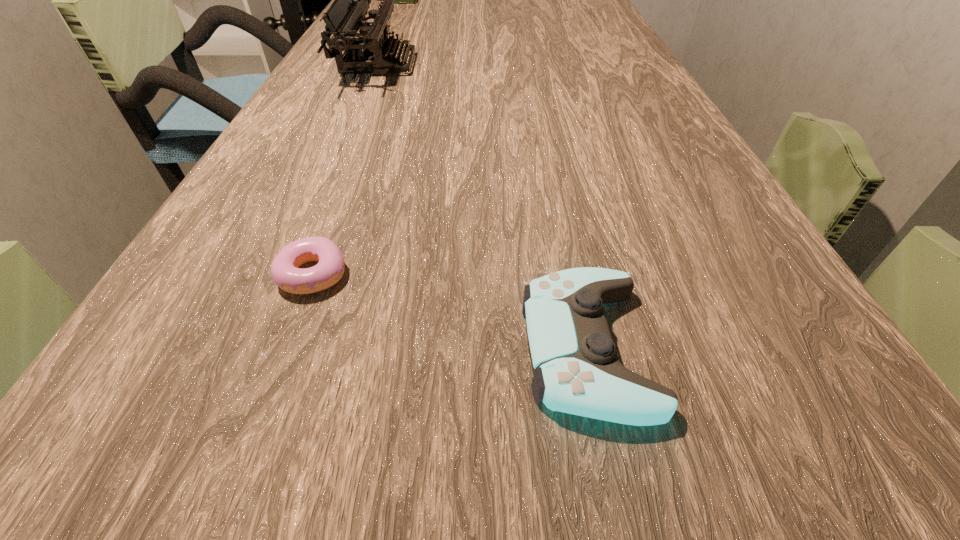
Identify the location of the second farthest object. This screenshot has width=960, height=540. (366, 52).

Identify the location of the second tallest object. This screenshot has width=960, height=540. (366, 52).

Locate an element on the screen. the third tallest object is located at coordinates (576, 370).

Locate an element on the screen. This screenshot has width=960, height=540. control is located at coordinates [x=576, y=370].

Locate an element on the screen. This screenshot has width=960, height=540. doughnut is located at coordinates (285, 271).

Identify the location of free location located 0.180m on the typing side of the typewriter. The height and width of the screenshot is (540, 960). (491, 65).

Find the location of `vacant space situated on the back of the control`. vacant space situated on the back of the control is located at coordinates (554, 186).

Locate an element on the screen. Image resolution: width=960 pixels, height=540 pixels. free space located 0.270m on the right of the doughnut is located at coordinates (564, 274).

Locate an element on the screen. Image resolution: width=960 pixels, height=540 pixels. typewriter at the left edge is located at coordinates (366, 52).

Locate an element on the screen. The image size is (960, 540). doughnut at the left edge is located at coordinates (285, 271).